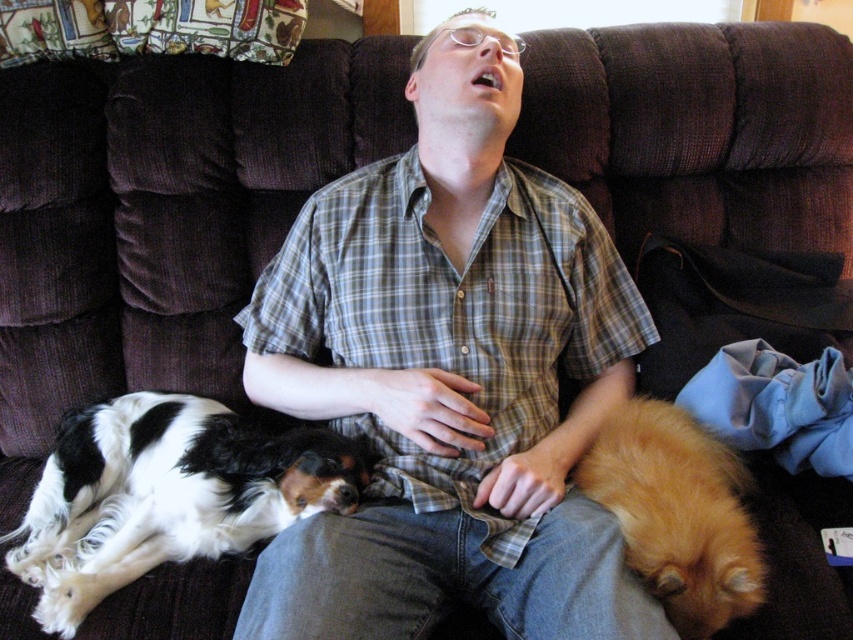
Question: In this image, where is black and white fur at left located relative to fuzzy golden dog at lower right?

Choices:
 (A) below
 (B) above

Answer: (A)

Question: Which point is closer to the camera?

Choices:
 (A) (709, 538)
 (B) (248, 538)

Answer: (A)

Question: Does black and white fur at left come behind fuzzy golden dog at lower right?

Choices:
 (A) yes
 (B) no

Answer: (A)

Question: Is plaid shirt at center bigger than fuzzy golden dog at lower right?

Choices:
 (A) no
 (B) yes

Answer: (B)

Question: Which object is the closest to the black and white fur at left?

Choices:
 (A) fuzzy golden dog at lower right
 (B) plaid shirt at center

Answer: (B)

Question: Which is nearer to the plaid shirt at center?

Choices:
 (A) fuzzy golden dog at lower right
 (B) black and white fur at left

Answer: (A)